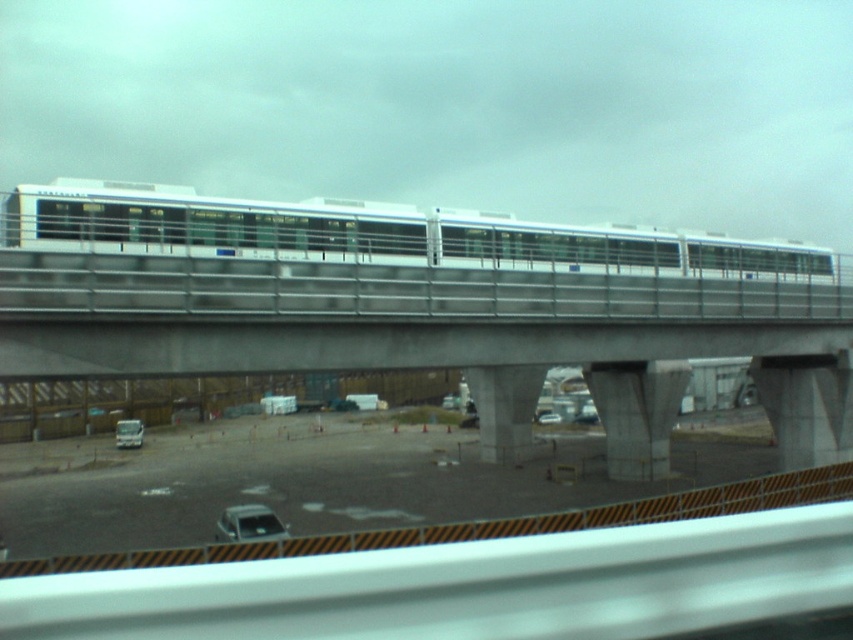
Question: Which of these objects is positioned closest to the silver metallic car at center?

Choices:
 (A) silver metallic car at lower center
 (B) silver metallic van at lower left

Answer: (B)

Question: Does concrete at center appear on the right side of silver metallic car at center?

Choices:
 (A) yes
 (B) no

Answer: (B)

Question: Which object is positioned farthest from the silver metallic van at lower left?

Choices:
 (A) silver metallic car at center
 (B) white glossy train at center

Answer: (B)

Question: Is white glossy train at center thinner than silver metallic car at lower center?

Choices:
 (A) yes
 (B) no

Answer: (B)

Question: Which object appears farthest from the camera in this image?

Choices:
 (A) silver metallic car at center
 (B) concrete at center
 (C) white glossy train at center

Answer: (A)

Question: Is concrete at center positioned in front of silver metallic car at center?

Choices:
 (A) no
 (B) yes

Answer: (B)